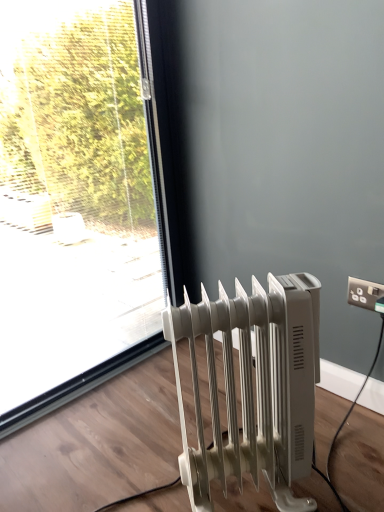
The width and height of the screenshot is (384, 512). In order to click on white plastic radiator at lower right in this screenshot , I will do `click(251, 389)`.

Where is `white plastic electrical outlet at upper right`? The height and width of the screenshot is (512, 384). white plastic electrical outlet at upper right is located at coordinates (364, 293).

Locate an element on the screen. This screenshot has height=512, width=384. white plastic radiator at lower right is located at coordinates (251, 389).

Is transparent glass window at upper left positioned with its back to white plastic radiator at lower right?

No, transparent glass window at upper left is not facing away from white plastic radiator at lower right.

Who is bigger, transparent glass window at upper left or white plastic radiator at lower right?

transparent glass window at upper left.

The height and width of the screenshot is (512, 384). Identify the location of window above the white plastic radiator at lower right (from the image's perspective). (80, 200).

Does transparent glass window at upper left come in front of white plastic radiator at lower right?

No, transparent glass window at upper left is further to the viewer.

The width and height of the screenshot is (384, 512). Identify the location of radiator that is below the transparent glass window at upper left (from the image's perspective). (251, 389).

From a real-world perspective, which is physically above, white plastic radiator at lower right or transparent glass window at upper left?

transparent glass window at upper left.

Is point (199, 496) positioned behind point (1, 320)?

No, it is not.

Which is in front, white plastic radiator at lower right or transparent glass window at upper left?

white plastic radiator at lower right is more forward.

From a real-world perspective, which is physically below, white plastic electrical outlet at upper right or transparent glass window at upper left?

From a 3D spatial view, white plastic electrical outlet at upper right is below.

Considering the relative sizes of white plastic electrical outlet at upper right and transparent glass window at upper left in the image provided, is white plastic electrical outlet at upper right bigger than transparent glass window at upper left?

No.

Is white plastic electrical outlet at upper right oriented away from transparent glass window at upper left?

No, white plastic electrical outlet at upper right is not facing the opposite direction of transparent glass window at upper left.

Is transparent glass window at upper left aimed at white plastic electrical outlet at upper right?

Yes, transparent glass window at upper left is facing white plastic electrical outlet at upper right.

Does point (23, 148) appear closer or farther from the camera than point (360, 283)?

Clearly, point (23, 148) is more distant from the camera than point (360, 283).

Looking at this image, is transparent glass window at upper left positioned beyond the bounds of white plastic electrical outlet at upper right?

Absolutely, transparent glass window at upper left is external to white plastic electrical outlet at upper right.

How many degrees apart are the facing directions of white plastic radiator at lower right and white plastic electrical outlet at upper right?

There is a 57.4-degree angle between the facing directions of white plastic radiator at lower right and white plastic electrical outlet at upper right.

Based on the photo, considering their positions, is white plastic radiator at lower right located in front of or behind white plastic electrical outlet at upper right?

Visually, white plastic radiator at lower right is located in front of white plastic electrical outlet at upper right.

Looking at this image, can you confirm if white plastic radiator at lower right is shorter than white plastic electrical outlet at upper right?

No.

Can you confirm if white plastic radiator at lower right is thinner than white plastic electrical outlet at upper right?

In fact, white plastic radiator at lower right might be wider than white plastic electrical outlet at upper right.

Is white plastic electrical outlet at upper right oriented away from white plastic radiator at lower right?

white plastic electrical outlet at upper right does not have its back to white plastic radiator at lower right.

Considering the relative sizes of white plastic electrical outlet at upper right and white plastic radiator at lower right in the image provided, is white plastic electrical outlet at upper right wider than white plastic radiator at lower right?

No.

Locate an element on the screen. This screenshot has width=384, height=512. window on the left of white plastic radiator at lower right is located at coordinates [x=80, y=200].

In the image, there is a white plastic radiator at lower right. Identify the location of window above it (from the image's perspective). The height and width of the screenshot is (512, 384). (80, 200).

When comparing their distances from transparent glass window at upper left, does white plastic electrical outlet at upper right or white plastic radiator at lower right seem further?

white plastic electrical outlet at upper right.

When comparing their distances from transparent glass window at upper left, does white plastic radiator at lower right or white plastic electrical outlet at upper right seem further?

white plastic electrical outlet at upper right lies further to transparent glass window at upper left than the other object.

When comparing their distances from white plastic electrical outlet at upper right, does white plastic radiator at lower right or transparent glass window at upper left seem further?

Among the two, transparent glass window at upper left is located further to white plastic electrical outlet at upper right.

Based on their spatial positions, is white plastic electrical outlet at upper right or transparent glass window at upper left further from white plastic radiator at lower right?

The object further to white plastic radiator at lower right is transparent glass window at upper left.

In the scene shown: Estimate the real-world distances between objects in this image. Which object is closer to white plastic electrical outlet at upper right, transparent glass window at upper left or white plastic radiator at lower right?

white plastic radiator at lower right is closer to white plastic electrical outlet at upper right.

Estimate the real-world distances between objects in this image. Which object is closer to white plastic radiator at lower right, transparent glass window at upper left or white plastic electrical outlet at upper right?

white plastic electrical outlet at upper right.

This screenshot has height=512, width=384. Find the location of `radiator located between transparent glass window at upper left and white plastic electrical outlet at upper right in the left-right direction`. radiator located between transparent glass window at upper left and white plastic electrical outlet at upper right in the left-right direction is located at coordinates (251, 389).